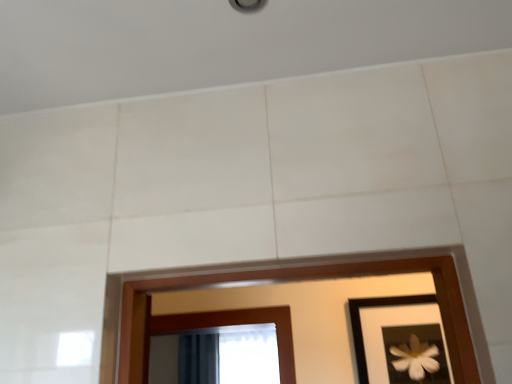
Question: Based on their positions, is black matte picture frame at lower right located to the left or right of dark blue fabric at lower center?

Choices:
 (A) right
 (B) left

Answer: (A)

Question: From a real-world perspective, is black matte picture frame at lower right positioned above or below dark blue fabric at lower center?

Choices:
 (A) above
 (B) below

Answer: (A)

Question: Considering the positions of black matte picture frame at lower right and dark blue fabric at lower center in the image, is black matte picture frame at lower right bigger or smaller than dark blue fabric at lower center?

Choices:
 (A) big
 (B) small

Answer: (B)

Question: Relative to black matte picture frame at lower right, is dark blue fabric at lower center in front or behind?

Choices:
 (A) behind
 (B) front

Answer: (A)

Question: Is dark blue fabric at lower center inside or outside of black matte picture frame at lower right?

Choices:
 (A) inside
 (B) outside

Answer: (B)

Question: Considering the relative positions of dark blue fabric at lower center and black matte picture frame at lower right in the image provided, is dark blue fabric at lower center to the left or to the right of black matte picture frame at lower right?

Choices:
 (A) right
 (B) left

Answer: (B)

Question: Considering the positions of point (195, 365) and point (403, 367), is point (195, 365) closer or farther from the camera than point (403, 367)?

Choices:
 (A) closer
 (B) farther

Answer: (B)